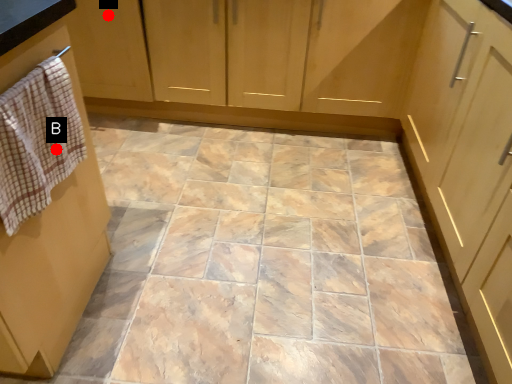
Question: Two points are circled on the image, labeled by A and B beside each circle. Which point is closer to the camera?

Choices:
 (A) A is closer
 (B) B is closer

Answer: (B)